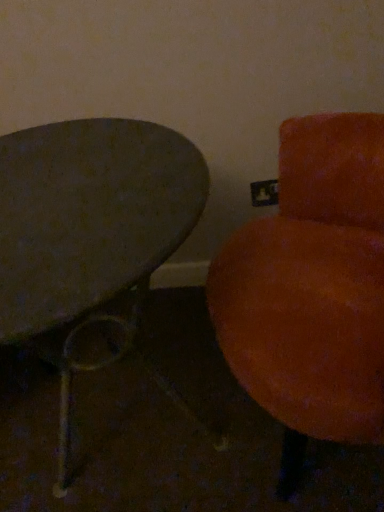
In order to click on empty space that is ontop of metallic gray table at left (from a real-world perspective) in this screenshot , I will do `click(72, 192)`.